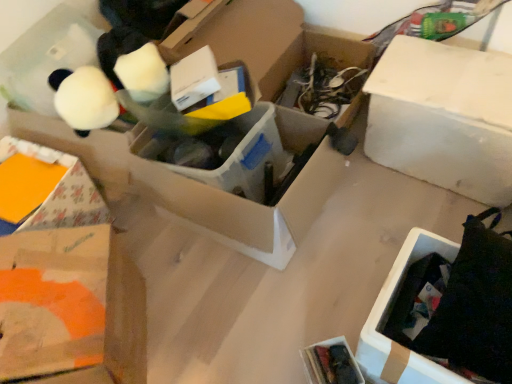
What are the coordinates of `blank space situated above white matte box at upper right (from a real-world perspective)` in the screenshot? It's located at (450, 78).